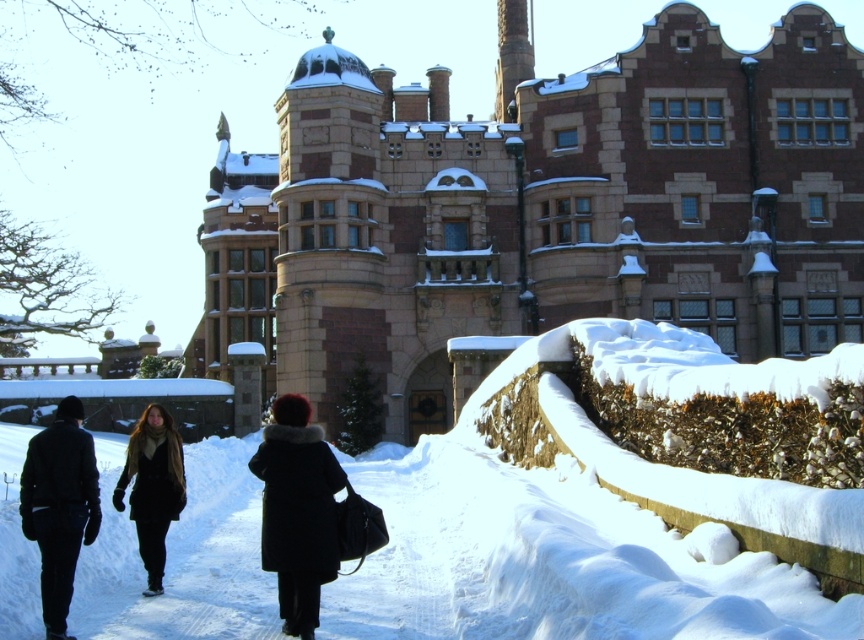
You are standing at the entrance of the historic building and see two coats on the path. Which coat is closer to the left side of the path? The coats are the dark wool coat at center and the velvet black coat at center.

The dark wool coat at center is positioned on the left side of the velvet black coat at center, so it is closer to the left side of the path.

Looking at this image, you are standing on the snow path and see two people wearing coats. The first person is wearing a velvet black coat at center and the second is wearing a velvet brown coat at center. Which coat is lower in position?

The velvet black coat at center is below the velvet brown coat at center, so the velvet black coat at center is lower in position.